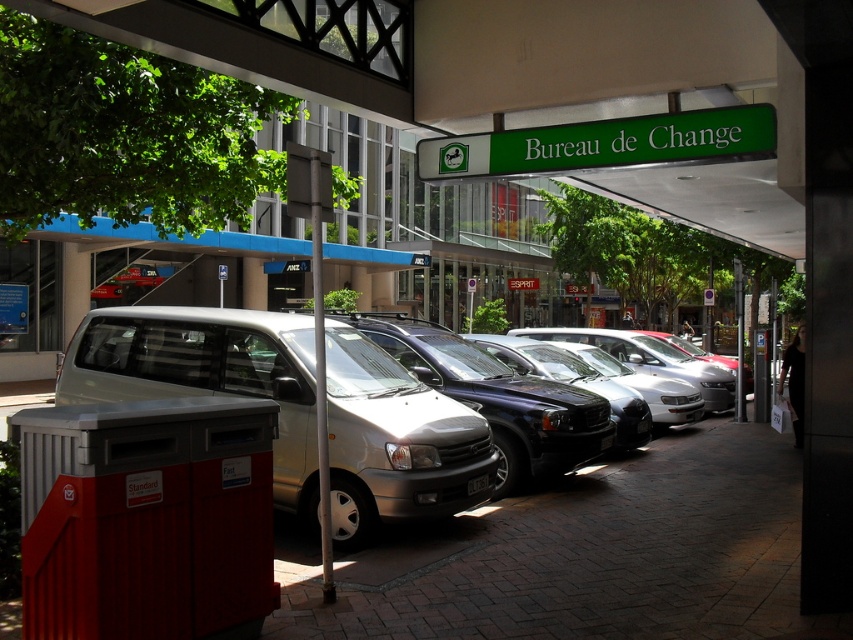
Is silver metallic van at center positioned behind green plastic sign at upper center?

Yes, it is behind green plastic sign at upper center.

Between point (149, 346) and point (618, 147), which one is positioned behind?

Positioned behind is point (149, 346).

Based on the photo, who is more forward, (381, 480) or (463, 148)?

Positioned in front is point (381, 480).

Where is `silver metallic van at center`? The height and width of the screenshot is (640, 853). silver metallic van at center is located at coordinates (440, 429).